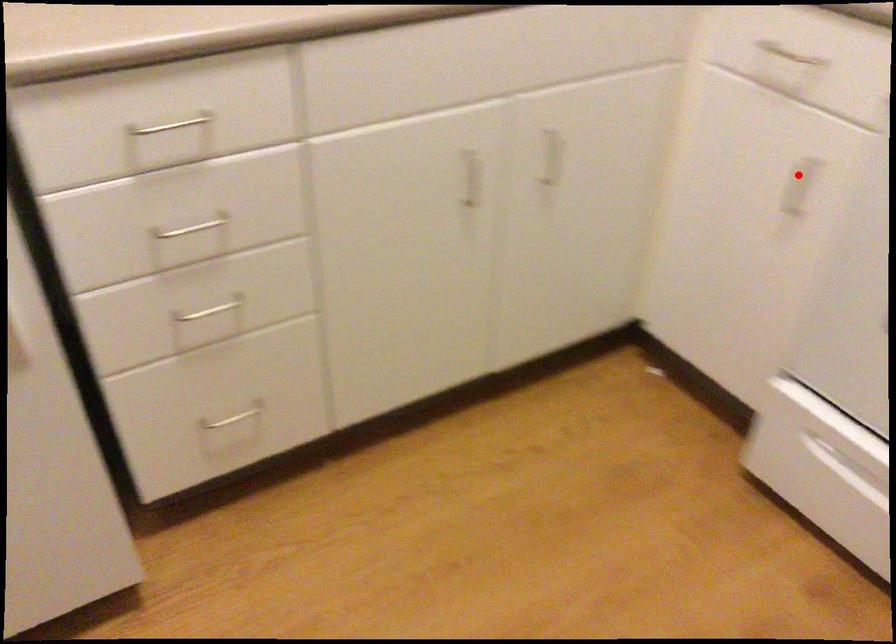
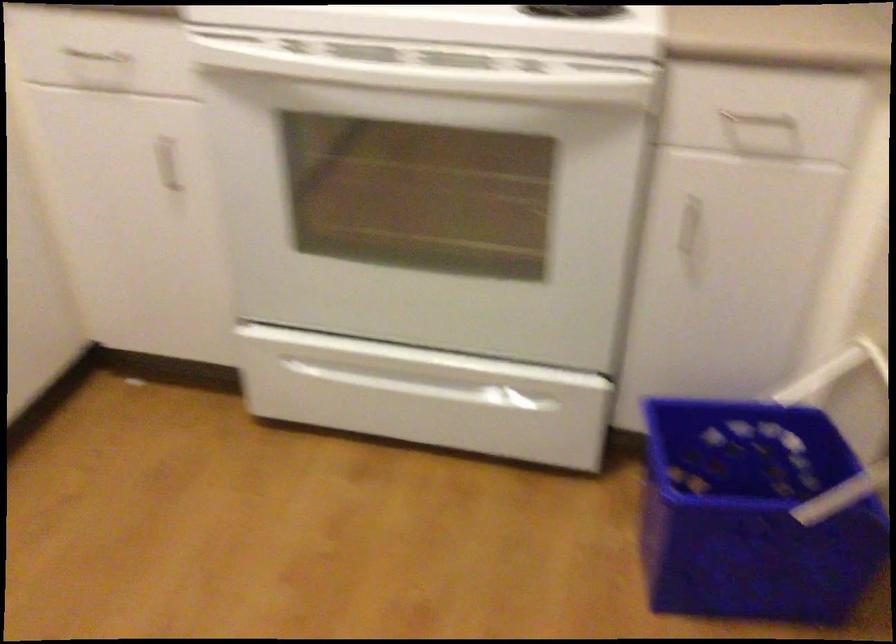
Where in the second image is the point corresponding to the highlighted location from the first image?

(167, 164)